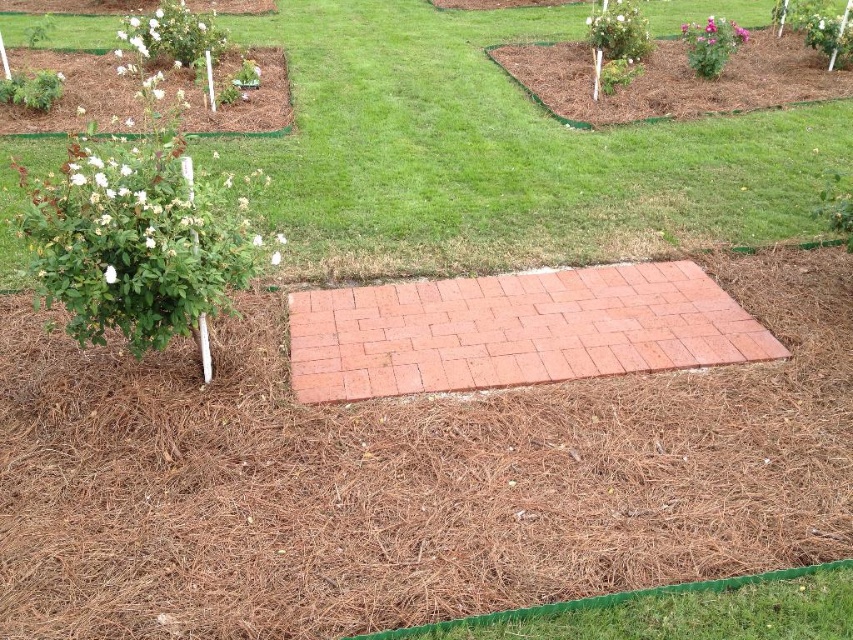
You are a gardener who wants to plant a new flower between the pink matte flower at upper right and the white matte flower at left. Based on their positions, which flower should you move to make space?

The pink matte flower at upper right is positioned over the white matte flower at left, so you should move the pink matte flower at upper right to make space for the new flower.

You are standing at the edge of the garden pathway and want to walk from point (572,337) to point (384,634). Which direction should you move to get closer to your destination?

You should move away from the viewer because point (572,337) is closer to the viewer than point (384,634). Moving away from the viewer will take you towards the destination.

You are standing at the point with coordinates (x=515, y=330) in the garden. What is located exactly at this point?

The red brick path at center is located exactly at point (x=515, y=330).